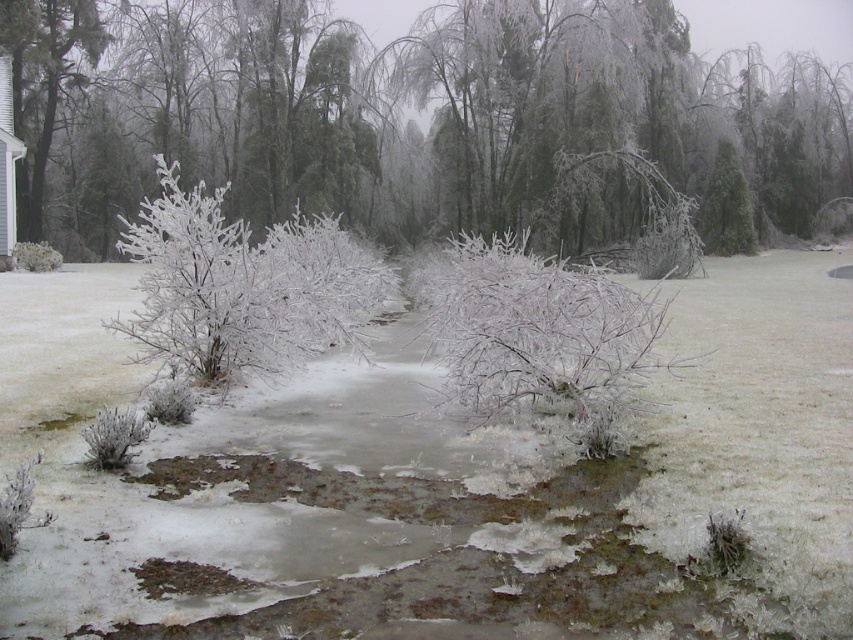
Can you confirm if frosted branches at center is thinner than frosted white bush at center?

Incorrect, frosted branches at center's width is not less than frosted white bush at center's.

Who is more distant from viewer, (453, 84) or (183, 200)?

The point (453, 84) is behind.

Who is more forward, (x=809, y=216) or (x=144, y=291)?

Positioned in front is point (x=144, y=291).

Identify the location of frosted branches at center. (410, 124).

Is frosted white bush at center further to the viewer compared to frosted white bush at upper right?

No, it is not.

Image resolution: width=853 pixels, height=640 pixels. What do you see at coordinates (242, 285) in the screenshot? I see `frosted white bush at center` at bounding box center [242, 285].

Is point (276, 227) more distant than point (738, 250)?

No, (276, 227) is closer to viewer.

Where is `frosted white bush at center`? The width and height of the screenshot is (853, 640). frosted white bush at center is located at coordinates (242, 285).

Can you confirm if frosted white bush at center is smaller than white frosty bush at lower left?

No.

Is frosted white bush at center shorter than white frosty bush at lower left?

Incorrect, frosted white bush at center's height does not fall short of white frosty bush at lower left's.

Which is behind, point (196, 326) or point (21, 252)?

The point (21, 252) is more distant.

You are a GUI agent. You are given a task and a screenshot of the screen. Output one action in this format:
    pyautogui.click(x=<x>, y=<y>)
    Task: Click on the frosted white bush at center
    The width and height of the screenshot is (853, 640).
    Given the screenshot: What is the action you would take?
    pyautogui.click(x=242, y=285)